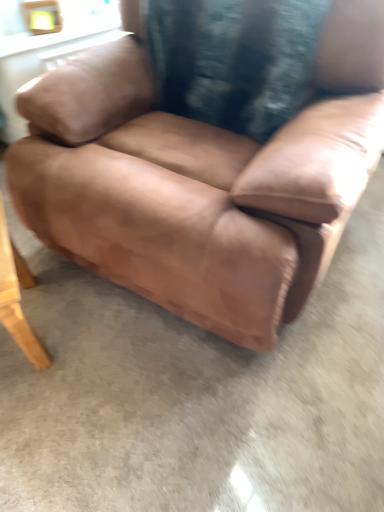
The height and width of the screenshot is (512, 384). What do you see at coordinates (233, 59) in the screenshot?
I see `velvety black pillow at center` at bounding box center [233, 59].

The height and width of the screenshot is (512, 384). What are the coordinates of `wooden table at lower left` in the screenshot? It's located at (17, 297).

Is brown leather chair at center closer to the viewer compared to wooden table at lower left?

Yes, brown leather chair at center is in front of wooden table at lower left.

Is brown leather chair at center looking in the opposite direction of wooden table at lower left?

No.

Is brown leather chair at center surrounding wooden table at lower left?

No, wooden table at lower left is not surrounded by brown leather chair at center.

Which of these two, brown leather chair at center or wooden table at lower left, is wider?

With larger width is brown leather chair at center.

In the image, there is a brown leather chair at center. Identify the location of pillow above it (from the image's perspective). (233, 59).

Is velvety black pillow at center facing away from brown leather chair at center?

Absolutely, velvety black pillow at center is directed away from brown leather chair at center.

Do you think velvety black pillow at center is within brown leather chair at center, or outside of it?

velvety black pillow at center lies within the bounds of brown leather chair at center.

Who is smaller, brown leather chair at center or velvety black pillow at center?

Smaller between the two is velvety black pillow at center.

Can you tell me how much brown leather chair at center and velvety black pillow at center differ in facing direction?

2.67e-05 degrees separate the facing orientations of brown leather chair at center and velvety black pillow at center.

Considering the relative positions of brown leather chair at center and velvety black pillow at center in the image provided, is brown leather chair at center to the left of velvety black pillow at center from the viewer's perspective?

Yes.

Where is `table below the brown leather chair at center (from the image's perspective)`? Image resolution: width=384 pixels, height=512 pixels. table below the brown leather chair at center (from the image's perspective) is located at coordinates (17, 297).

Does wooden table at lower left have a smaller size compared to brown leather chair at center?

Indeed, wooden table at lower left has a smaller size compared to brown leather chair at center.

Which is in front, wooden table at lower left or brown leather chair at center?

brown leather chair at center is more forward.

Is wooden table at lower left next to brown leather chair at center and touching it?

No.

Considering the relative sizes of wooden table at lower left and velvety black pillow at center in the image provided, is wooden table at lower left wider than velvety black pillow at center?

Indeed, wooden table at lower left has a greater width compared to velvety black pillow at center.

Is wooden table at lower left in front of or behind velvety black pillow at center in the image?

In the image, wooden table at lower left appears in front of velvety black pillow at center.

Does point (0, 274) come farther from viewer compared to point (228, 57)?

No.

Looking at this image, is the depth of velvety black pillow at center less than that of wooden table at lower left?

No, velvety black pillow at center is further to the viewer.

Considering the points (254, 108) and (2, 251), which point is in front, point (254, 108) or point (2, 251)?

The point (2, 251) is in front.

Could you tell me if velvety black pillow at center is turned towards wooden table at lower left?

Yes, velvety black pillow at center is oriented towards wooden table at lower left.

Where is `table below the velvety black pillow at center (from a real-world perspective)`? The height and width of the screenshot is (512, 384). table below the velvety black pillow at center (from a real-world perspective) is located at coordinates (17, 297).

Locate an element on the screen. table on the left of brown leather chair at center is located at coordinates (17, 297).

Locate an element on the screen. chair beneath the velvety black pillow at center (from a real-world perspective) is located at coordinates (202, 181).

From the picture: Considering their positions, is brown leather chair at center positioned further to wooden table at lower left than velvety black pillow at center?

velvety black pillow at center is further to wooden table at lower left.

Based on the photo, considering their positions, is wooden table at lower left positioned further to velvety black pillow at center than brown leather chair at center?

The object further to velvety black pillow at center is wooden table at lower left.

In the scene shown: Estimate the real-world distances between objects in this image. Which object is closer to wooden table at lower left, velvety black pillow at center or brown leather chair at center?

Among the two, brown leather chair at center is located nearer to wooden table at lower left.

From the image, which object appears to be nearer to brown leather chair at center, wooden table at lower left or velvety black pillow at center?

velvety black pillow at center.

From the image, which object appears to be farther from brown leather chair at center, velvety black pillow at center or wooden table at lower left?

Based on the image, wooden table at lower left appears to be further to brown leather chair at center.

Looking at the image, which one is located closer to velvety black pillow at center, brown leather chair at center or wooden table at lower left?

Among the two, brown leather chair at center is located nearer to velvety black pillow at center.

Where is `chair that lies between velvety black pillow at center and wooden table at lower left from top to bottom`? Image resolution: width=384 pixels, height=512 pixels. chair that lies between velvety black pillow at center and wooden table at lower left from top to bottom is located at coordinates (202, 181).